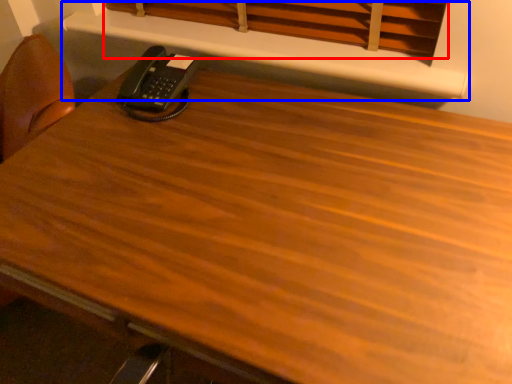
Question: Among these objects, which one is nearest to the camera, curtain (highlighted by a red box) or shelf (highlighted by a blue box)?

Choices:
 (A) curtain
 (B) shelf

Answer: (A)